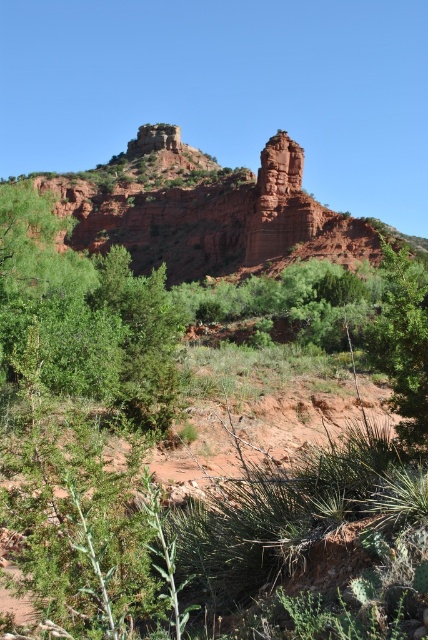
Question: Which point is closer to the camera taking this photo?

Choices:
 (A) (50, 212)
 (B) (261, 157)

Answer: (A)

Question: Which object appears closest to the camera in this image?

Choices:
 (A) reddish-brown sandstone rock formation at center-right
 (B) reddish-brown rock formation at center

Answer: (B)

Question: Which object appears closest to the camera in this image?

Choices:
 (A) reddish-brown rock formation at center
 (B) green leafy tree at lower left

Answer: (B)

Question: Does reddish-brown rock formation at center appear on the right side of green leafy tree at lower left?

Choices:
 (A) no
 (B) yes

Answer: (A)

Question: Does reddish-brown rock formation at center appear under reddish-brown sandstone rock formation at center-right?

Choices:
 (A) yes
 (B) no

Answer: (B)

Question: Is green textured tree at lower right positioned in front of reddish-brown sandstone rock formation at center-right?

Choices:
 (A) no
 (B) yes

Answer: (B)